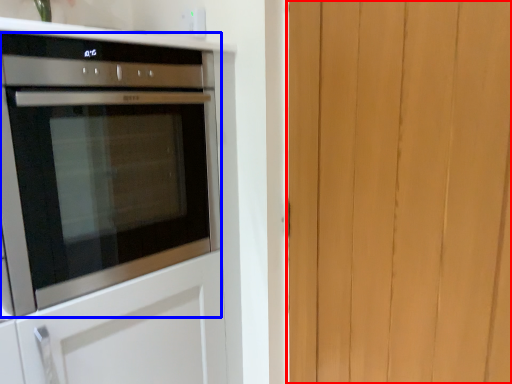
Question: Which point is further to the camera, barn door (highlighted by a red box) or oven (highlighted by a blue box)?

Choices:
 (A) barn door
 (B) oven

Answer: (B)